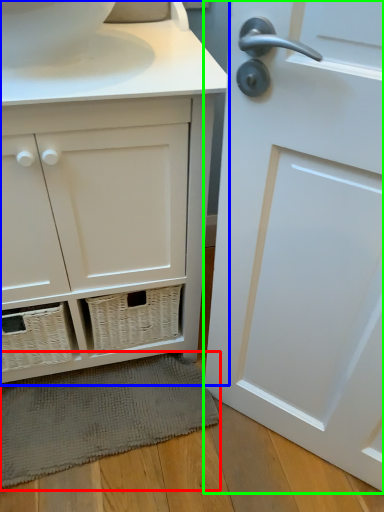
Question: Estimate the real-world distances between objects in this image. Which object is farther from bath mat (highlighted by a red box), bathroom cabinet (highlighted by a blue box) or door (highlighted by a green box)?

Choices:
 (A) bathroom cabinet
 (B) door

Answer: (B)